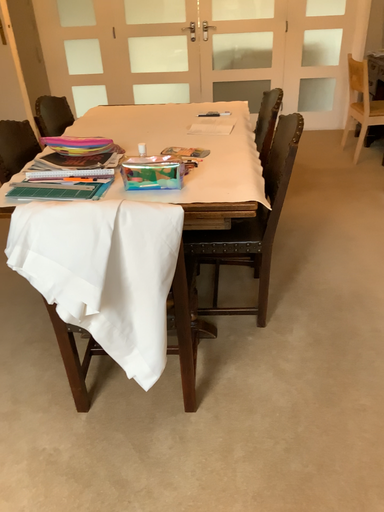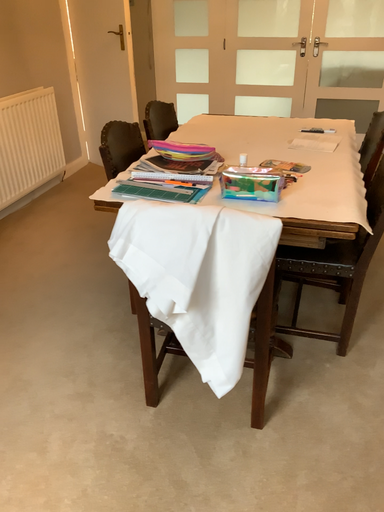
Question: How did the camera likely rotate when shooting the video?

Choices:
 (A) rotated right
 (B) rotated left

Answer: (B)